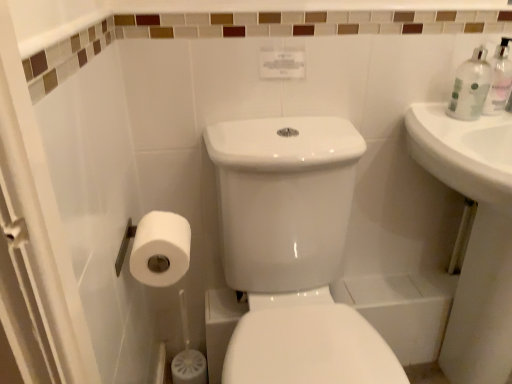
Find the location of a particular element. This screenshot has height=384, width=512. vacant space to the left of clear plastic bottle at upper right is located at coordinates (426, 109).